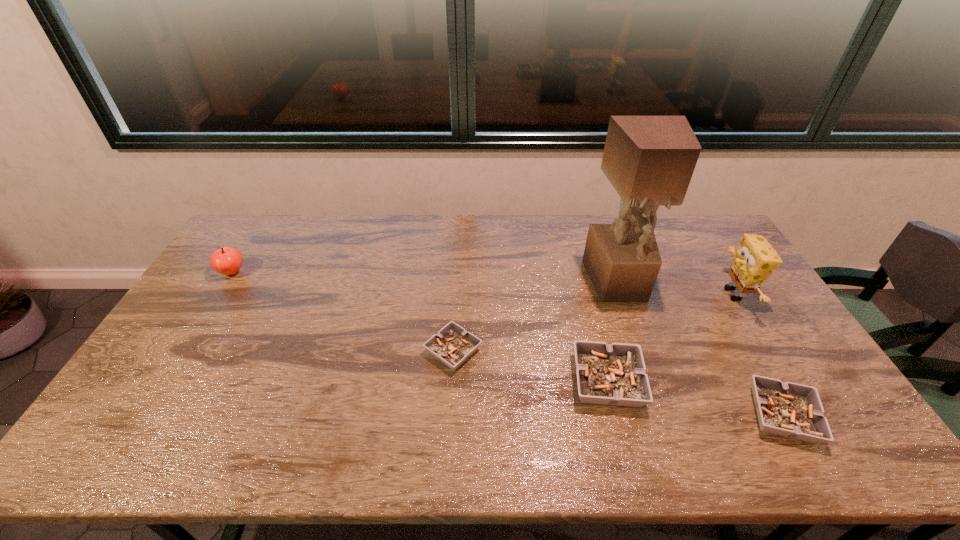
The width and height of the screenshot is (960, 540). I want to click on vacant position located on the right of the shortest object, so click(x=557, y=351).

You are a GUI agent. You are given a task and a screenshot of the screen. Output one action in this format:
    pyautogui.click(x=<x>, y=<y>)
    Task: Click on the free space located 0.260m on the left of the fourth tallest object
    
    Given the screenshot: What is the action you would take?
    pyautogui.click(x=473, y=381)

Locate an element on the screen. vacant region located 0.180m on the back of the second shortest ashtray is located at coordinates (736, 333).

Identify the location of free space located 0.370m on the face of the fifth shortest object. The image size is (960, 540). (604, 294).

Identify the location of free space located 0.130m on the face of the fifth shortest object. The image size is (960, 540). (679, 294).

The height and width of the screenshot is (540, 960). I want to click on vacant area located on the face of the fifth shortest object, so click(701, 294).

Locate an element on the screen. Image resolution: width=960 pixels, height=540 pixels. vacant space located 0.060m on the front-facing side of the sculpture is located at coordinates (631, 319).

Where is `blank space located on the back of the apple`? The height and width of the screenshot is (540, 960). blank space located on the back of the apple is located at coordinates (253, 239).

Locate an element on the screen. object that is at the left edge is located at coordinates (227, 260).

The width and height of the screenshot is (960, 540). I want to click on ashtray present at the right edge, so click(x=792, y=410).